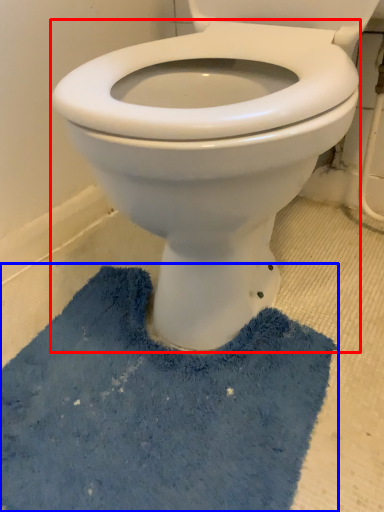
Question: Which of the following is the farthest to the observer, bidet (highlighted by a red box) or bath mat (highlighted by a blue box)?

Choices:
 (A) bidet
 (B) bath mat

Answer: (B)